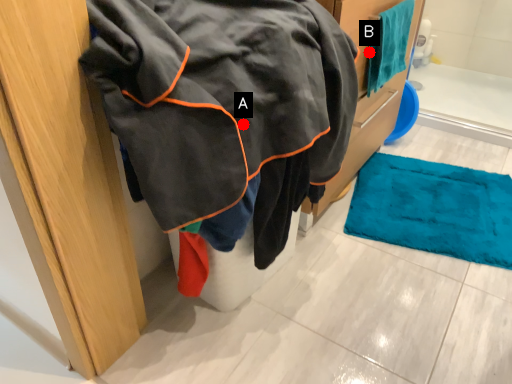
Question: Two points are circled on the image, labeled by A and B beside each circle. Which of the following is the farthest from the observer?

Choices:
 (A) A is further
 (B) B is further

Answer: (B)